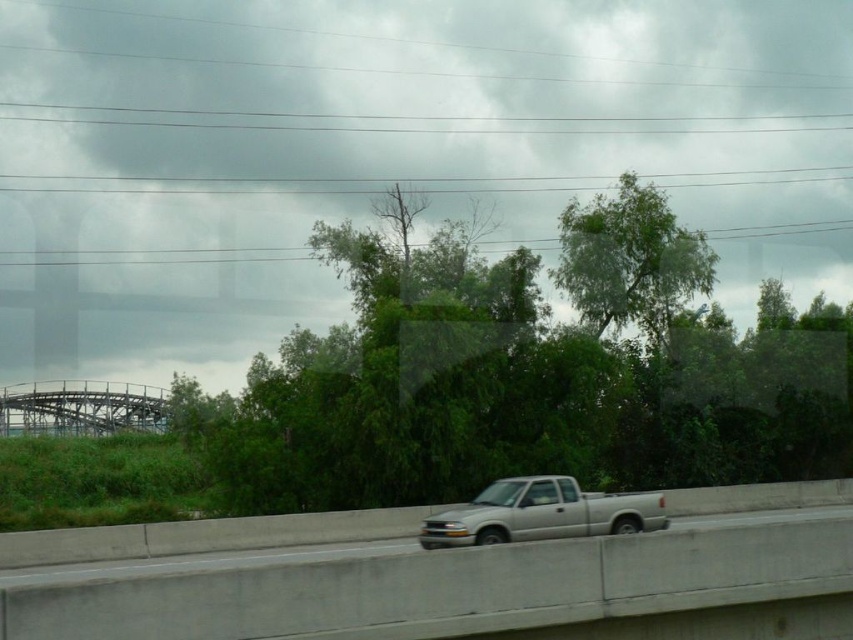
Is point (613, 276) in front of point (497, 540)?

That is False.

Between green leafy tree at upper center and silver metallic truck at center, which one is positioned higher?

Positioned higher is green leafy tree at upper center.

Locate an element on the screen. Image resolution: width=853 pixels, height=640 pixels. green leafy tree at upper center is located at coordinates (630, 259).

Locate an element on the screen. The image size is (853, 640). green leafy tree at upper center is located at coordinates (630, 259).

Can you confirm if green leafy tree at center is thinner than green leafy tree at upper center?

Incorrect, green leafy tree at center's width is not less than green leafy tree at upper center's.

In the scene shown: Which is above, green leafy tree at center or green leafy tree at upper center?

green leafy tree at upper center is above.

Identify the location of green leafy tree at center. (526, 378).

Which is more to the left, green leafy tree at center or metallic gray roller coaster at upper left?

From the viewer's perspective, metallic gray roller coaster at upper left appears more on the left side.

Is point (241, 484) closer to viewer compared to point (30, 388)?

Yes, it is in front of point (30, 388).

Identify the location of green leafy tree at center. (526, 378).

At what (x,y) coordinates should I click in order to perform the action: click on green leafy tree at center. Please return your answer as a coordinate pair (x, y). The width and height of the screenshot is (853, 640). Looking at the image, I should click on (526, 378).